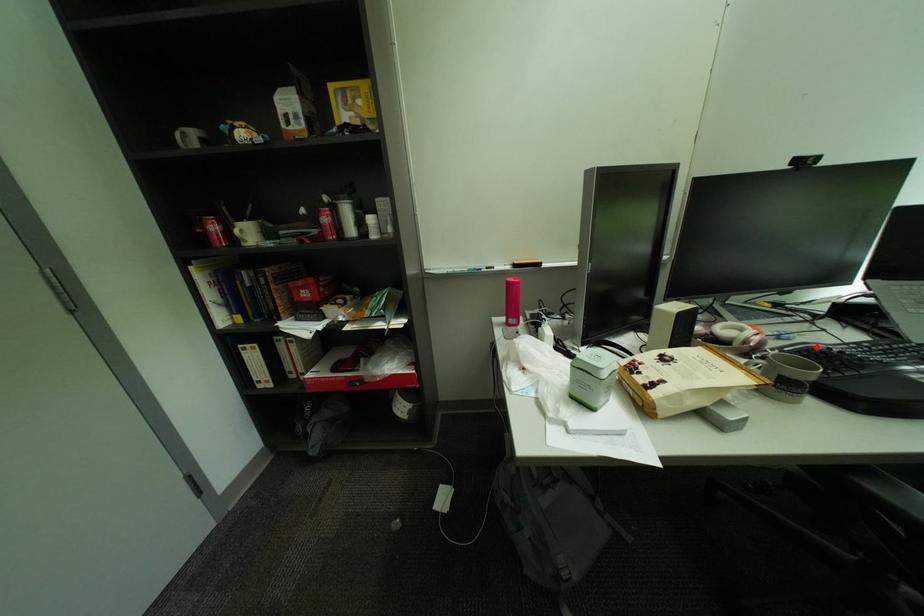
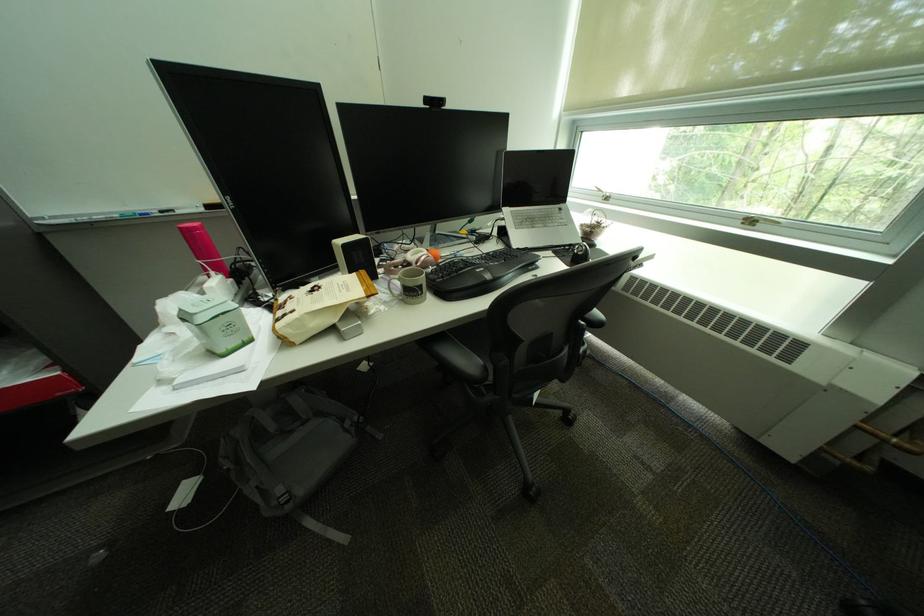
The point at the highlighted location is marked in the first image. Where is the corresponding point in the second image?

(463, 261)